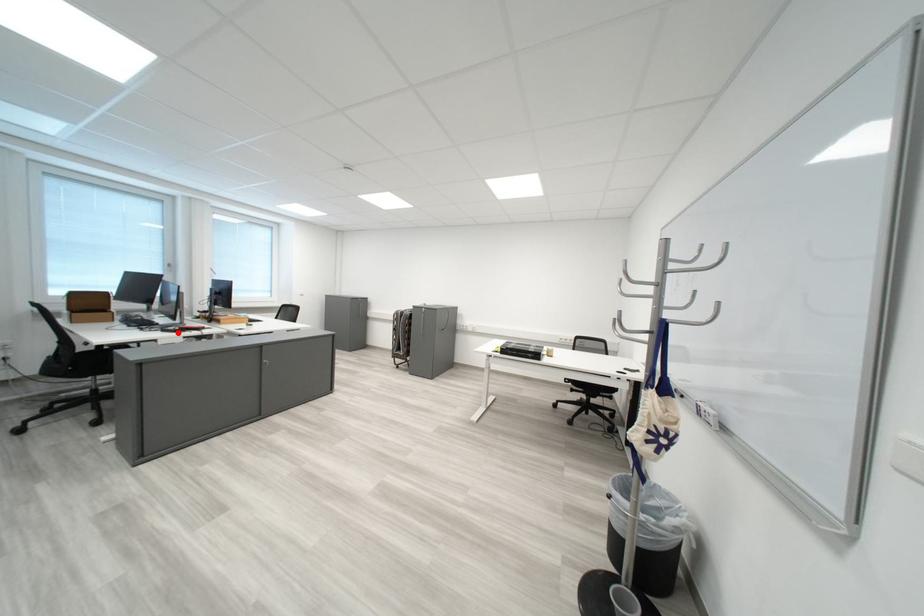
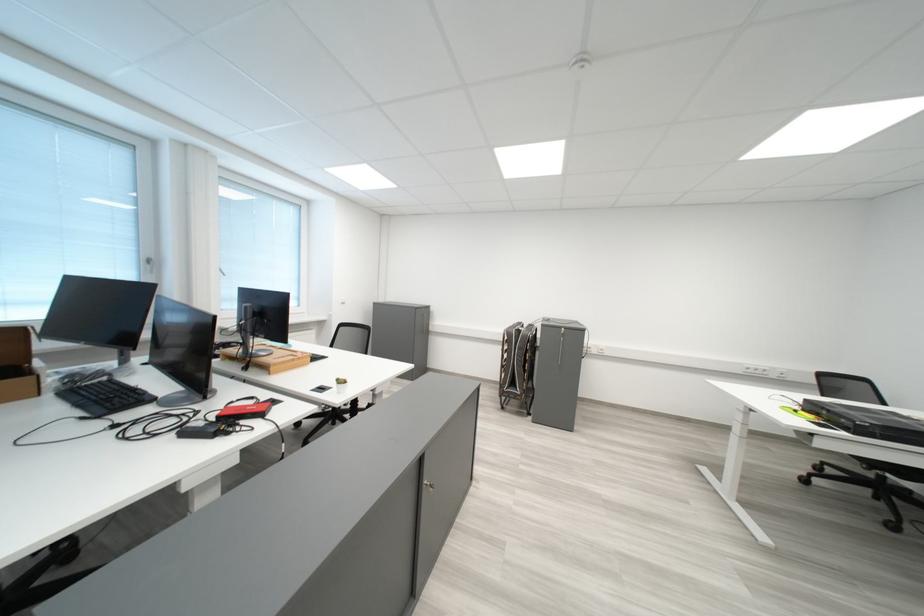
Find the pixel in the second image that matches the highlighted location in the first image.

(200, 436)